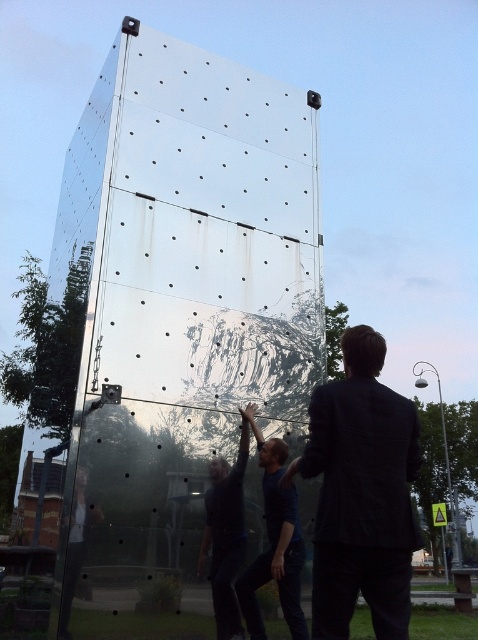
You are a photographer trying to capture a clear image of both the dark suit at center and the dark gray fabric shirt at center. Since both are in the same location, which one will appear bigger in the photo?

The dark suit at center will appear bigger in the photo because it is larger in size than the dark gray fabric shirt at center.

You are standing in front of the reflective metallic structure and notice a point marked at coordinates (360,493). What object is located at this point?

The point at coordinates (360,493) marks the location of the dark suit at center.

You are standing in front of the reflective metallic structure and see the transparent glass at center and the dark suit at center. Which object is positioned to the left?

The transparent glass at center is to the left of the dark suit at center, so the transparent glass at center is positioned to the left.